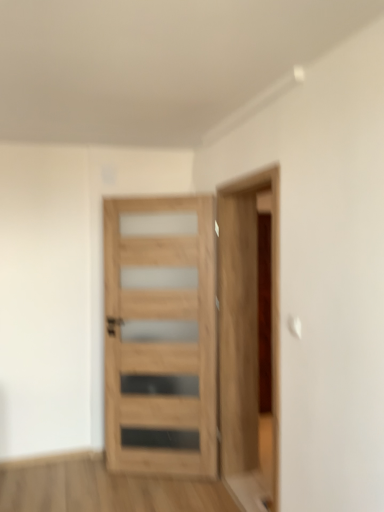
I want to click on vacant space in natural wood door at center (from a real-world perspective), so pos(160,474).